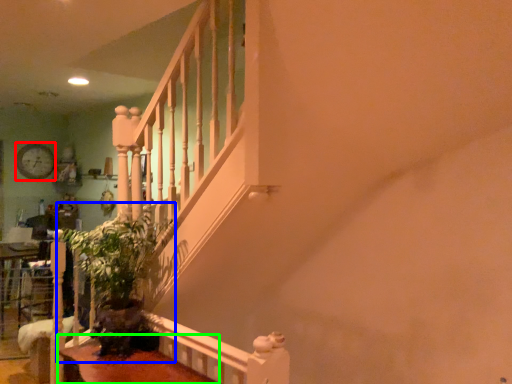
Question: Which object is positioned farthest from clock (highlighted by a red box)? Select from plant (highlighted by a blue box) and table (highlighted by a green box).

Choices:
 (A) plant
 (B) table

Answer: (B)